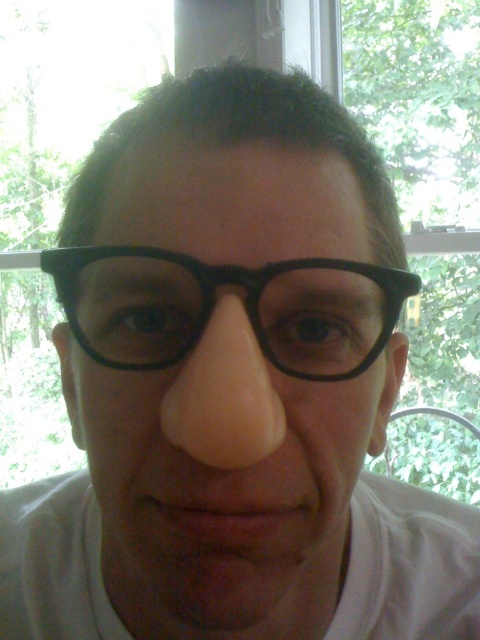
Does matte black glasses at center have a greater height compared to black plastic glasses at center?

Correct, matte black glasses at center is much taller as black plastic glasses at center.

At what (x,y) coordinates should I click in order to perform the action: click on matte black glasses at center. Please return your answer as a coordinate pair (x, y). Looking at the image, I should click on (225, 483).

In order to click on matte black glasses at center in this screenshot , I will do `click(225, 483)`.